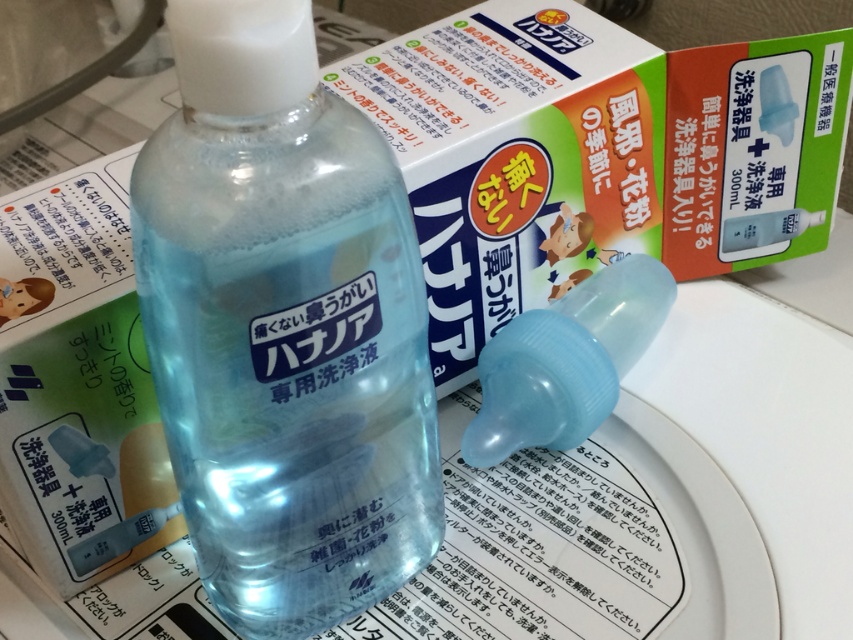
You have to choose between the transparent plastic bottle at center and the transparent plastic nasal spray at center to store a small medication. Which one can hold the medication better?

The transparent plastic bottle at center is much taller than the transparent plastic nasal spray at center, so it can hold the medication better.

You are a customer looking at the nasal irrigation kit. You want to grab the item that is closer to you. Which one should you choose between the transparent plastic bottle at center and the transparent plastic nasal spray at center?

The transparent plastic bottle at center is closer to the viewer than the transparent plastic nasal spray at center, so you should choose the transparent plastic bottle at center.